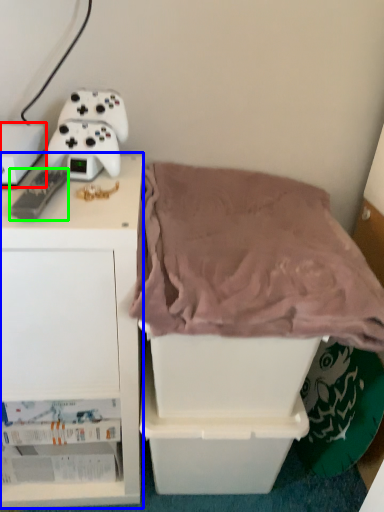
Question: Considering the real-world distances, which object is farthest from storage box (highlighted by a red box)? furniture (highlighted by a blue box) or game controller (highlighted by a green box)?

Choices:
 (A) furniture
 (B) game controller

Answer: (A)